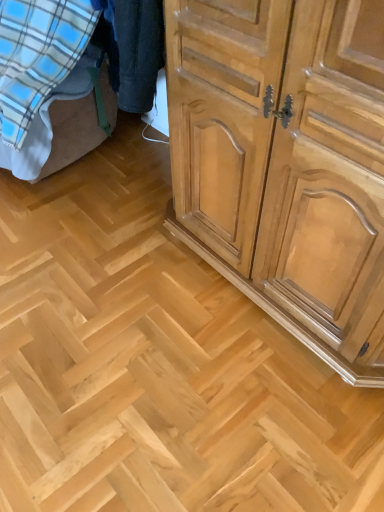
Question: Would you say blue plaid fabric at lower left is part of light brown wood cabinet at right's contents?

Choices:
 (A) yes
 (B) no

Answer: (B)

Question: Is light brown wood cabinet at right with blue plaid fabric at lower left?

Choices:
 (A) no
 (B) yes

Answer: (A)

Question: Is light brown wood cabinet at right aimed at blue plaid fabric at lower left?

Choices:
 (A) yes
 (B) no

Answer: (B)

Question: Does light brown wood cabinet at right come behind blue plaid fabric at lower left?

Choices:
 (A) no
 (B) yes

Answer: (A)

Question: Can you confirm if light brown wood cabinet at right is positioned to the right of blue plaid fabric at lower left?

Choices:
 (A) no
 (B) yes

Answer: (B)

Question: Considering the relative positions of light brown wood cabinet at right and blue plaid fabric at lower left in the image provided, is light brown wood cabinet at right to the left of blue plaid fabric at lower left from the viewer's perspective?

Choices:
 (A) no
 (B) yes

Answer: (A)

Question: From the image's perspective, is blue plaid fabric at lower left under light brown wood cabinet at right?

Choices:
 (A) no
 (B) yes

Answer: (A)

Question: Could you tell me if blue plaid fabric at lower left is facing light brown wood cabinet at right?

Choices:
 (A) yes
 (B) no

Answer: (B)

Question: Is blue plaid fabric at lower left placed right next to light brown wood cabinet at right?

Choices:
 (A) yes
 (B) no

Answer: (B)

Question: Is blue plaid fabric at lower left to the right of light brown wood cabinet at right from the viewer's perspective?

Choices:
 (A) no
 (B) yes

Answer: (A)

Question: From a real-world perspective, is blue plaid fabric at lower left located higher than light brown wood cabinet at right?

Choices:
 (A) yes
 (B) no

Answer: (B)

Question: Does blue plaid fabric at lower left appear on the left side of light brown wood cabinet at right?

Choices:
 (A) no
 (B) yes

Answer: (B)

Question: In terms of width, does light brown wood cabinet at right look wider or thinner when compared to blue plaid fabric at lower left?

Choices:
 (A) wide
 (B) thin

Answer: (B)